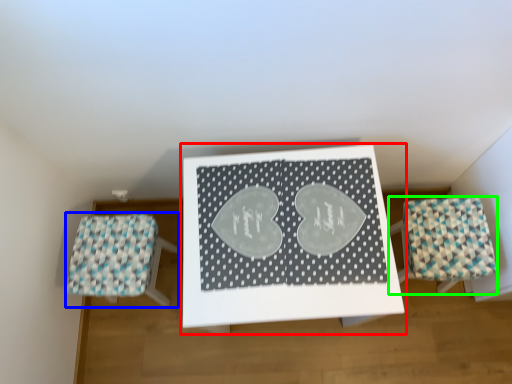
Question: Which object is the closest to the table (highlighted by a red box)? Choose among these: furniture (highlighted by a blue box) or furniture (highlighted by a green box).

Choices:
 (A) furniture
 (B) furniture

Answer: (B)